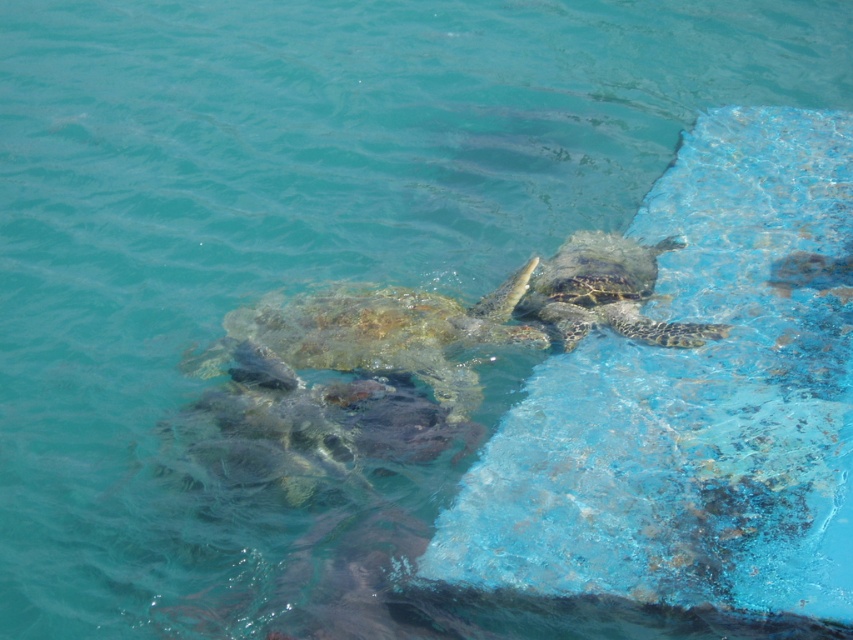
Question: Which object appears closest to the camera in this image?

Choices:
 (A) leathery greenish-brown turtle at upper right
 (B) rusty brown shell at center

Answer: (B)

Question: Is rusty brown shell at center positioned at the back of leathery greenish-brown turtle at upper right?

Choices:
 (A) yes
 (B) no

Answer: (B)

Question: Which of the following is the closest to the observer?

Choices:
 (A) rusty brown shell at center
 (B) leathery greenish-brown turtle at upper right

Answer: (A)

Question: Which point appears closest to the camera in this image?

Choices:
 (A) 643,298
 (B) 410,298

Answer: (B)

Question: Is rusty brown shell at center to the left of leathery greenish-brown turtle at upper right from the viewer's perspective?

Choices:
 (A) no
 (B) yes

Answer: (B)

Question: Can you confirm if rusty brown shell at center is positioned above leathery greenish-brown turtle at upper right?

Choices:
 (A) no
 (B) yes

Answer: (A)